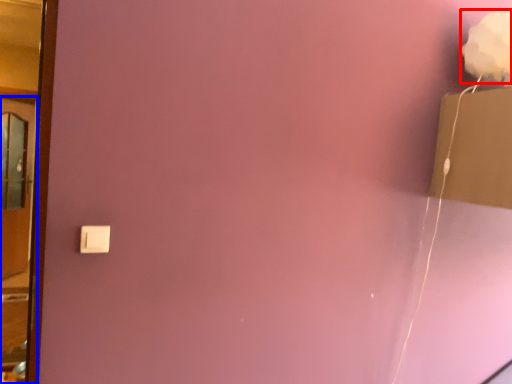
Question: Which object appears farthest to the camera in this image, flower (highlighted by a red box) or door (highlighted by a blue box)?

Choices:
 (A) flower
 (B) door

Answer: (A)